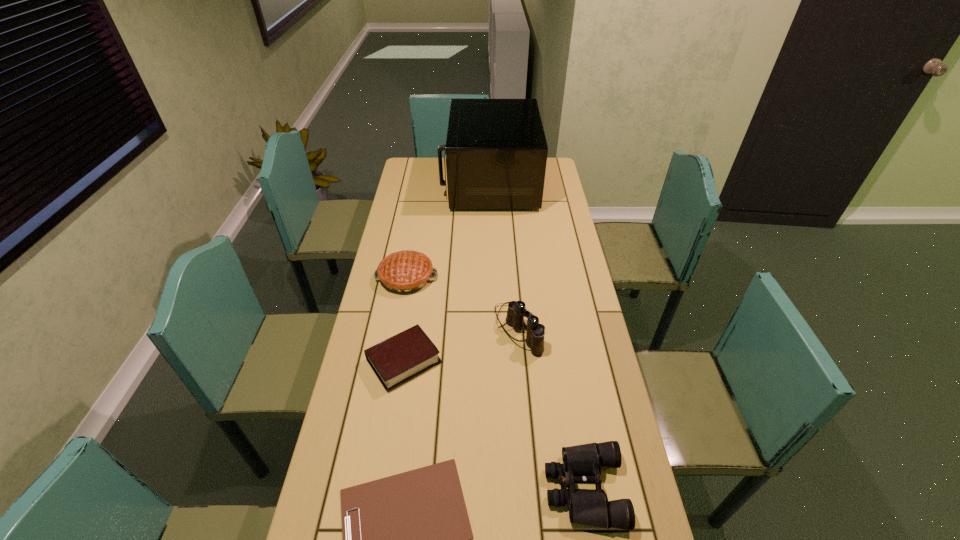
I want to click on the tallest object, so click(496, 151).

This screenshot has width=960, height=540. In order to click on the farthest object in this screenshot , I will do `click(496, 151)`.

Where is `the farther binoculars`? the farther binoculars is located at coordinates (516, 312).

Find the location of a particular element. The height and width of the screenshot is (540, 960). the second tallest object is located at coordinates (516, 312).

Locate an element on the screen. The width and height of the screenshot is (960, 540). pie is located at coordinates (406, 271).

Where is `the fourth shortest object`? Image resolution: width=960 pixels, height=540 pixels. the fourth shortest object is located at coordinates (406, 271).

This screenshot has height=540, width=960. I want to click on the shorter binoculars, so click(x=582, y=463).

Find the location of a particular element. This screenshot has height=540, width=960. the nearer binoculars is located at coordinates (582, 463).

Image resolution: width=960 pixels, height=540 pixels. Find the location of `the second shortest object`. the second shortest object is located at coordinates (403, 356).

The height and width of the screenshot is (540, 960). I want to click on free space located 0.170m on the front-facing side of the tallest object, so click(408, 183).